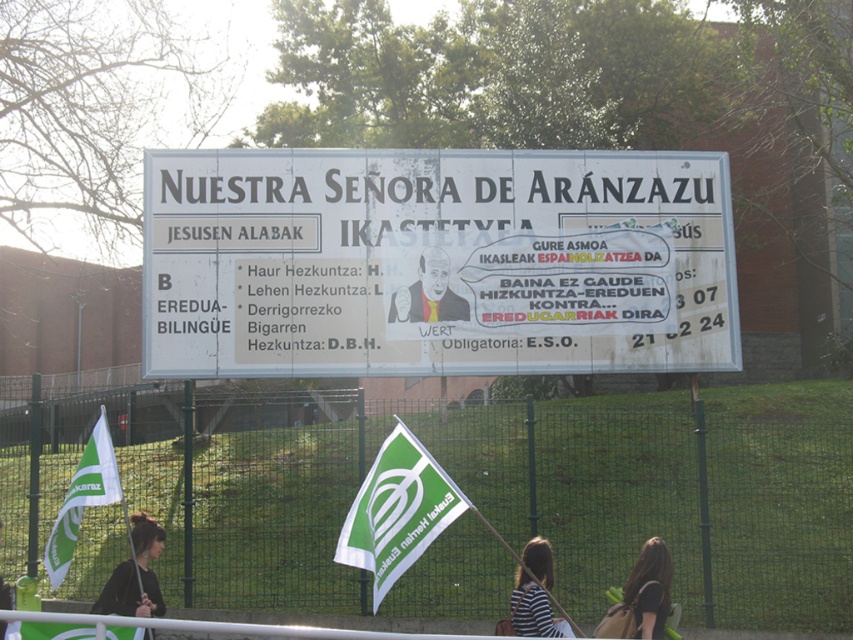
Between green fabric flag at lower center and cartoon figure at center, which one is positioned higher?

Positioned higher is cartoon figure at center.

Does green fabric flag at lower center appear on the left side of cartoon figure at center?

Indeed, green fabric flag at lower center is positioned on the left side of cartoon figure at center.

Between point (404, 454) and point (408, 308), which one is positioned in front?

Positioned in front is point (404, 454).

I want to click on green fabric flag at lower center, so click(397, 509).

Is white paper sign at center above dark brown hair at center?

Yes, white paper sign at center is above dark brown hair at center.

Is white paper sign at center to the left of dark brown hair at center from the viewer's perspective?

Indeed, white paper sign at center is positioned on the left side of dark brown hair at center.

Is point (706, 294) positioned after point (630, 600)?

Yes, it is.

The width and height of the screenshot is (853, 640). I want to click on white paper sign at center, so click(448, 260).

Does green fabric flag at lower left appear on the left side of striped fabric shirt at center?

Correct, you'll find green fabric flag at lower left to the left of striped fabric shirt at center.

Looking at this image, is green fabric flag at lower left closer to camera compared to striped fabric shirt at center?

No, it is not.

The height and width of the screenshot is (640, 853). What do you see at coordinates (82, 499) in the screenshot?
I see `green fabric flag at lower left` at bounding box center [82, 499].

This screenshot has width=853, height=640. I want to click on green fabric flag at lower left, so pyautogui.click(x=82, y=499).